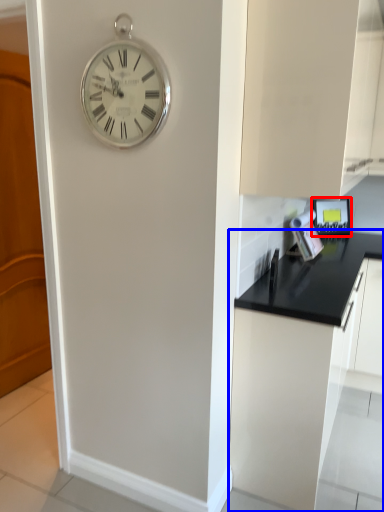
Question: Which object appears closest to the camera in this image, appliance (highlighted by a red box) or cabinetry (highlighted by a blue box)?

Choices:
 (A) appliance
 (B) cabinetry

Answer: (B)